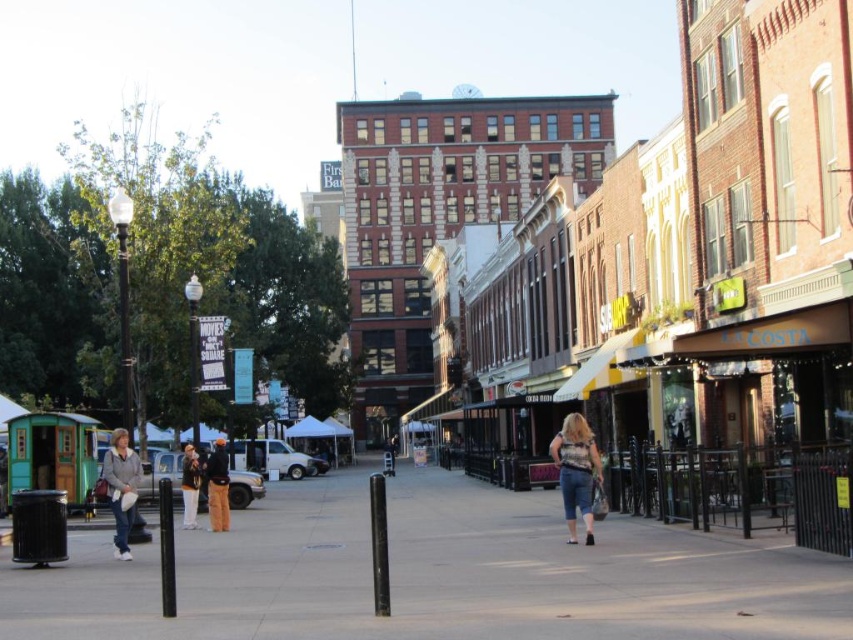
Question: Is black smooth pole at center below brown corduroy pants at center?

Choices:
 (A) no
 (B) yes

Answer: (B)

Question: Which point is closer to the camera taking this photo?

Choices:
 (A) coord(115,436)
 (B) coord(213,467)
 (C) coord(192,518)
 (D) coord(161,552)

Answer: (D)

Question: Estimate the real-world distances between objects in this image. Which object is closer to the brown corduroy pants at center?

Choices:
 (A) black smooth pole at center
 (B) gray concrete sidewalk at center
 (C) light gray sweater at lower left

Answer: (C)

Question: In this image, where is denim shorts at center located relative to black smooth pole at center?

Choices:
 (A) below
 (B) above

Answer: (B)

Question: Does gray concrete sidewalk at center have a larger size compared to black matte pole at center?

Choices:
 (A) no
 (B) yes

Answer: (B)

Question: Which of the following is the closest to the observer?

Choices:
 (A) click(381, 596)
 (B) click(444, 500)
 (C) click(189, 515)

Answer: (A)